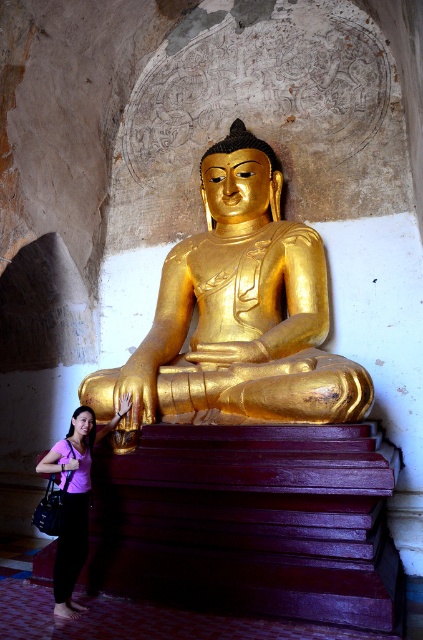
You are a photographer trying to capture the gold polished statue at center without any obstructions. However, there is a purple fabric shirt at lower left in your shot. Can you move the shirt to the side so it doesn

The purple fabric shirt at lower left is behind the gold polished statue at center, so moving it would require adjusting its position from behind the statue. Since the statue is the main subject, carefully moving the shirt from behind should allow you to capture the statue without obstruction.

You are standing in the temple facing the golden Buddha statue. There is a point marked at coordinates [250,522] which corresponds to wooden stairs at center. If you want to go down the wooden stairs at center, which direction should you face?

The wooden stairs at center are located at point [250,522]. Since you are facing the golden Buddha statue, you should turn around and face away from the statue to go down the wooden stairs at center.

You are standing in front of the temple entrance and want to approach the gold polished statue at center. There are wooden stairs at center in your path. Which object will you encounter first?

The wooden stairs at center is closer to the viewer than the gold polished statue at center, so you will encounter the wooden stairs at center first before reaching the gold polished statue at center.